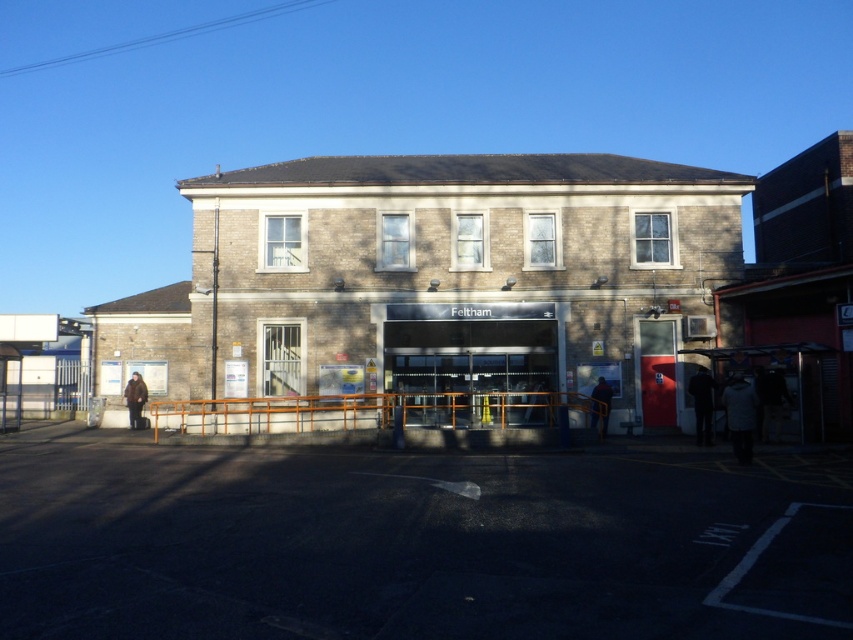
Question: Which point is farther to the camera?

Choices:
 (A) white fabric at center
 (B) dark blue jeans at center
 (C) dark blue jacket at right

Answer: (B)

Question: Which point is farther to the camera?

Choices:
 (A) white fabric at center
 (B) dark blue jacket at right
 (C) dark clothing at right
 (D) brown fuzzy coat at lower left

Answer: (D)

Question: Can you confirm if dark clothing at right is thinner than dark blue jacket at right?

Choices:
 (A) yes
 (B) no

Answer: (B)

Question: Which object appears closest to the camera in this image?

Choices:
 (A) white fabric at center
 (B) dark clothing at right

Answer: (A)

Question: Does white fabric at center have a greater width compared to dark blue jeans at center?

Choices:
 (A) yes
 (B) no

Answer: (B)

Question: Where is dark clothing at right located in relation to dark blue jeans at center in the image?

Choices:
 (A) below
 (B) above

Answer: (B)